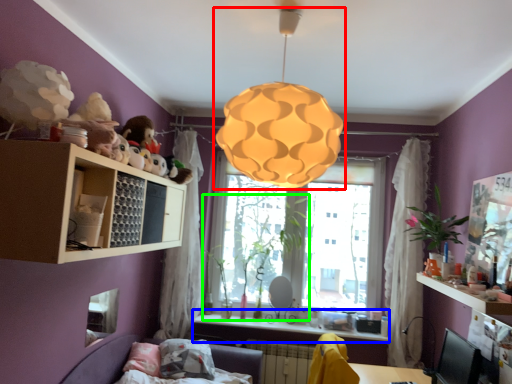
Question: Estimate the real-world distances between objects in this image. Which object is closer to lamp (highlighted by a red box), counter top (highlighted by a blue box) or plant (highlighted by a green box)?

Choices:
 (A) counter top
 (B) plant

Answer: (B)